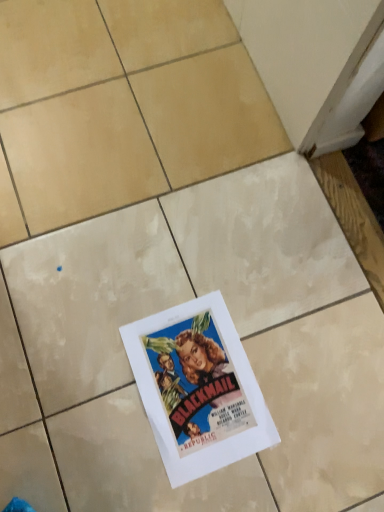
Identify the location of spots to the right of matte paper poster at center. This screenshot has width=384, height=512. (317, 392).